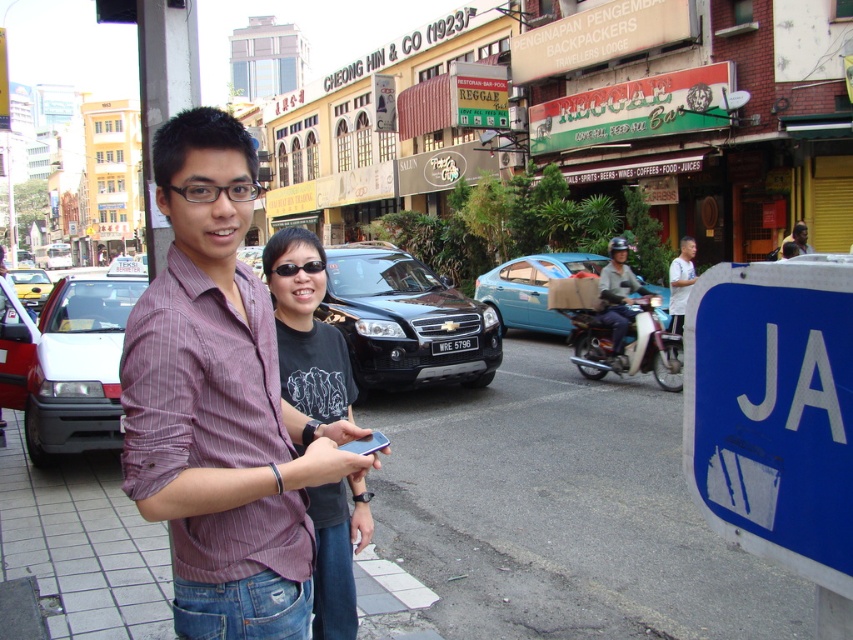
Is blue plastic sign at lower right above light blue matte car at center?

Actually, blue plastic sign at lower right is below light blue matte car at center.

Is blue plastic sign at lower right further to camera compared to light blue matte car at center?

No, it is in front of light blue matte car at center.

The height and width of the screenshot is (640, 853). Describe the element at coordinates (775, 410) in the screenshot. I see `blue plastic sign at lower right` at that location.

Image resolution: width=853 pixels, height=640 pixels. I want to click on blue plastic sign at lower right, so click(775, 410).

Can you confirm if black matte shirt at center is positioned to the left of dark gray helmeted man on motorcycle at center?

Indeed, black matte shirt at center is positioned on the left side of dark gray helmeted man on motorcycle at center.

Which is behind, point (335, 566) or point (622, 320)?

Point (622, 320)

You are a GUI agent. You are given a task and a screenshot of the screen. Output one action in this format:
    pyautogui.click(x=<x>, y=<y>)
    Task: Click on the black matte shirt at center
    The image size is (853, 640).
    Given the screenshot: What is the action you would take?
    pyautogui.click(x=306, y=328)

Is light blue matte car at center thinner than dark gray helmeted man on motorcycle at center?

No.

Does light blue matte car at center come in front of dark gray helmeted man on motorcycle at center?

No, light blue matte car at center is behind dark gray helmeted man on motorcycle at center.

Which is behind, point (567, 272) or point (618, 243)?

Positioned behind is point (567, 272).

Identify the location of light blue matte car at center. The width and height of the screenshot is (853, 640). (531, 289).